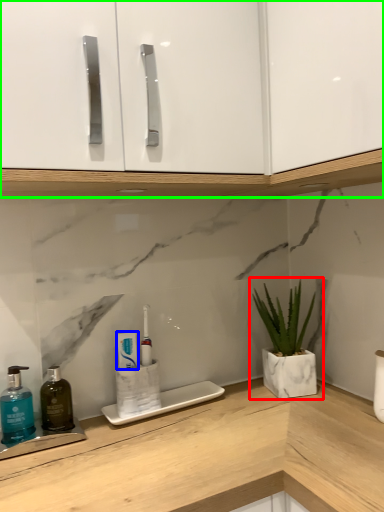
Question: Considering the real-world distances, which object is farthest from houseplant (highlighted by a red box)? toothpaste (highlighted by a blue box) or cabinetry (highlighted by a green box)?

Choices:
 (A) toothpaste
 (B) cabinetry

Answer: (B)